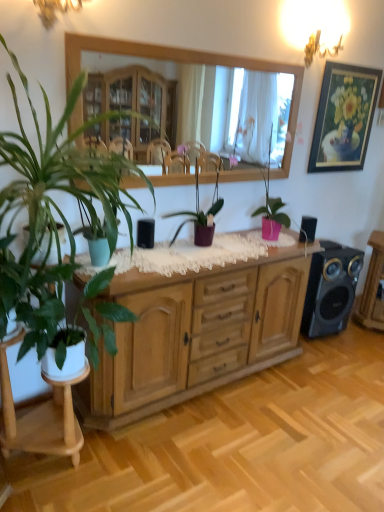
Question: From a real-world perspective, relative to gold-framed painting at upper right, is green matte plant at left, the 4th houseplant viewed from the right, vertically above or below?

Choices:
 (A) above
 (B) below

Answer: (B)

Question: Looking at the image, does green matte plant at left, the first houseplant from the left, seem bigger or smaller compared to gold-framed painting at upper right?

Choices:
 (A) big
 (B) small

Answer: (A)

Question: Which of these objects is positioned farthest from the purple matte plant at center, the second houseplant in the right-to-left sequence?

Choices:
 (A) pink matte plant at center, which ranks as the 4th houseplant in left-to-right order
 (B) black plastic speaker at right, acting as the second speaker starting from the left
 (C) green matte plant at left, the first houseplant from the left
 (D) matte gold sconce at upper left, arranged as the second lamp when viewed from the back
 (E) metallic gold chandelier at upper right, the 1th lamp viewed from the right

Answer: (D)

Question: Which object is the farthest from the wooden mirror at upper center?

Choices:
 (A) black glossy speaker at right, which ranks as the third speaker in front-to-back order
 (B) pink matte plant at center, which ranks as the 4th houseplant in left-to-right order
 (C) metallic gold chandelier at upper right, the 1th lamp viewed from the right
 (D) green matte plant at left, the 4th houseplant viewed from the right
 (E) gold-framed painting at upper right

Answer: (A)